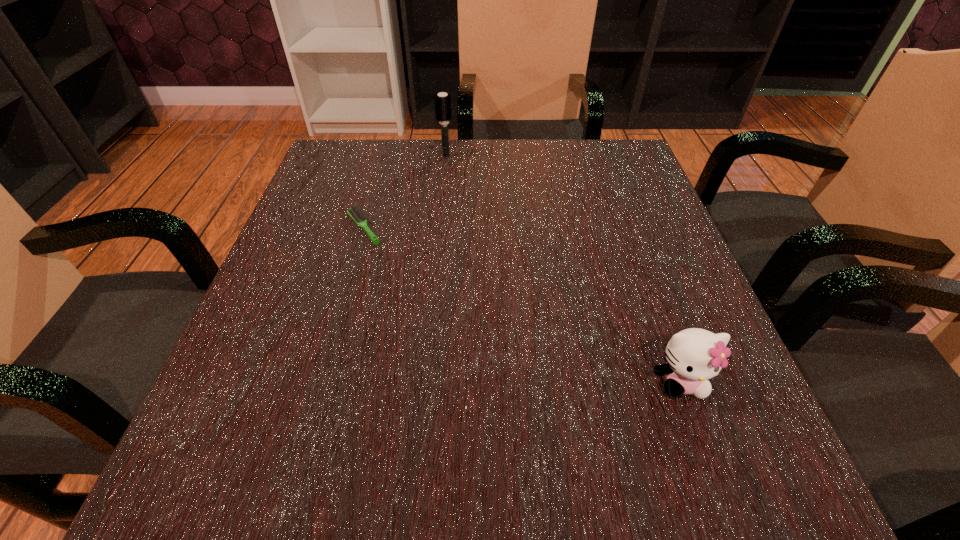
Image resolution: width=960 pixels, height=540 pixels. Find the location of `free space between the shorter hairbrush and the right hairbrush`. free space between the shorter hairbrush and the right hairbrush is located at coordinates (405, 192).

Locate an element on the screen. The height and width of the screenshot is (540, 960). free area in between the leftmost object and the farthest object is located at coordinates (405, 192).

This screenshot has width=960, height=540. I want to click on vacant area between the second farthest object and the nearest object, so click(522, 305).

The width and height of the screenshot is (960, 540). I want to click on free spot between the farthest object and the kitten, so click(x=564, y=268).

Locate an element on the screen. This screenshot has height=540, width=960. empty location between the shorter hairbrush and the second shortest object is located at coordinates (522, 305).

Where is `free spot between the farther hairbrush and the nearer hairbrush`? free spot between the farther hairbrush and the nearer hairbrush is located at coordinates (405, 192).

I want to click on empty space that is in between the nearest object and the shortest object, so click(x=522, y=305).

Select which object is the closest to the nearest object. Please provide its 2D coordinates. Your answer should be formatted as a tuple, i.e. [(x, y)], where the tuple contains the x and y coordinates of a point satisfying the conditions above.

[(357, 215)]

Identify the location of the closest object to the farther hairbrush. (357, 215).